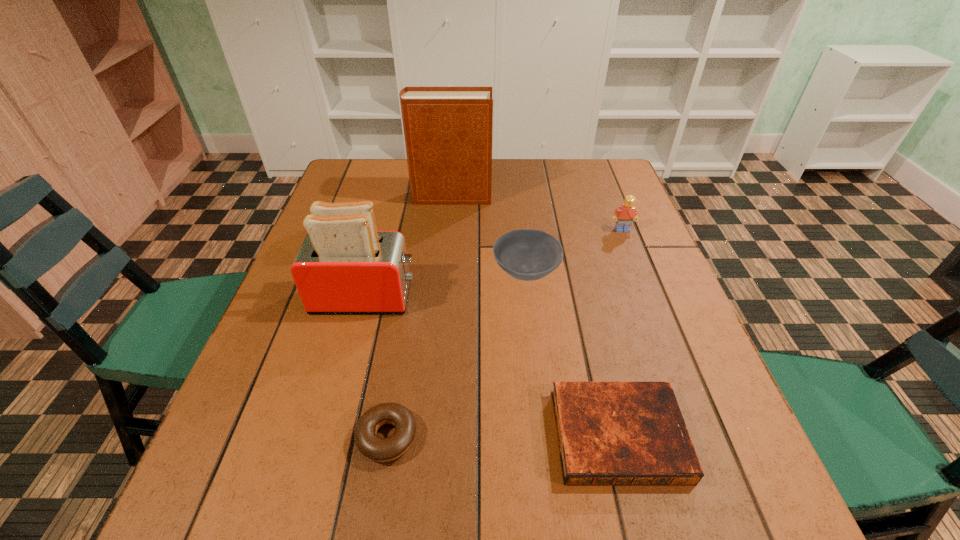
Find the location of a particular element. The width and height of the screenshot is (960, 540). empty space that is in between the bowl and the doughnut is located at coordinates (457, 355).

At what (x,y) coordinates should I click in order to perform the action: click on free space between the Bible and the toaster. Please return your answer as a coordinate pair (x, y). The width and height of the screenshot is (960, 540). Looking at the image, I should click on (492, 366).

The image size is (960, 540). Find the location of `vacant point located between the farthest object and the Bible`. vacant point located between the farthest object and the Bible is located at coordinates pos(535,316).

Find the location of a particular element. The width and height of the screenshot is (960, 540). empty space that is in between the Lego and the hardback book is located at coordinates (537, 213).

At what (x,y) coordinates should I click in order to perform the action: click on free spot between the doughnut and the third shortest object. Please return your answer as a coordinate pair (x, y). Looking at the image, I should click on (457, 355).

I want to click on free space between the tallest object and the Bible, so click(x=535, y=316).

Locate an element on the screen. Image resolution: width=960 pixels, height=540 pixels. unoccupied area between the tallest object and the Bible is located at coordinates (535, 316).

Select which object appears as the third closest to the Bible. Please provide its 2D coordinates. Your answer should be formatted as a tuple, i.e. [(x, y)], where the tuple contains the x and y coordinates of a point satisfying the conditions above.

[(344, 265)]

Point out which object is positioned as the nearest to the toaster. Please provide its 2D coordinates. Your answer should be formatted as a tuple, i.e. [(x, y)], where the tuple contains the x and y coordinates of a point satisfying the conditions above.

[(526, 254)]

Where is `free location that satisfies the following two spatial constraints: 1. on the front-facing side of the second farthest object; 2. on the front-facing side of the toaster`? The height and width of the screenshot is (540, 960). free location that satisfies the following two spatial constraints: 1. on the front-facing side of the second farthest object; 2. on the front-facing side of the toaster is located at coordinates (648, 297).